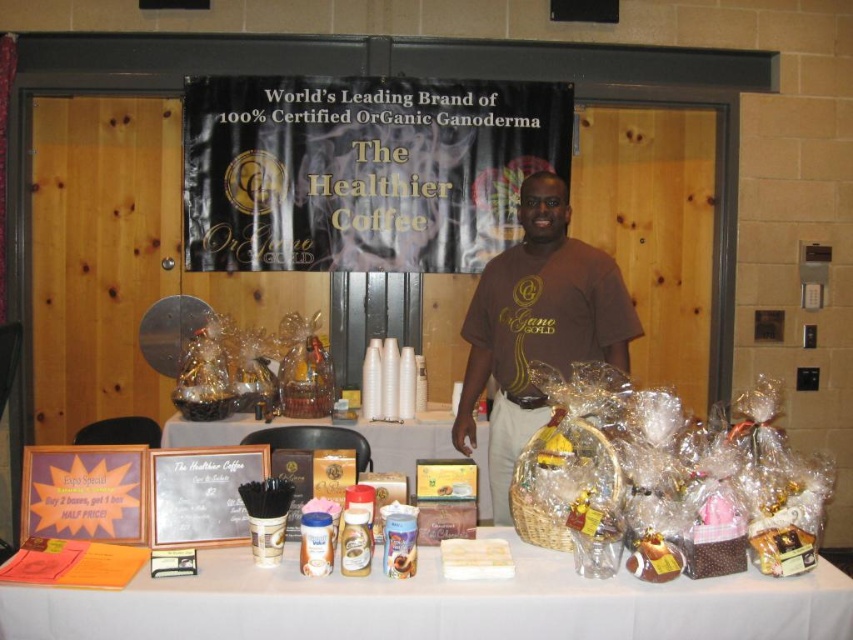
You are setting up a booth for The Healthier Coffee. You need to hang a new banner that is 2 meters tall. The booth currently has a black fabric banner at upper center and a wooden signboard at center. Which object can you place the new banner next to without blocking the other?

The black fabric banner at upper center is much taller than the wooden signboard at center, so placing the new 2m tall banner next to the wooden signboard at center would prevent it from blocking the taller black fabric banner at upper center.

You are a customer at the event and want to take a photo with the black fabric banner at upper center and the matte brown wicker basket at center. Which object should you stand closer to for it to appear larger in your photo?

To make both objects appear larger in your photo, you should stand closer to the black fabric banner at upper center since it is bigger than the matte brown wicker basket at center.

You are a customer at the promotional setup for The Healthier Coffee. You see a black fabric banner at upper center and a white paper at center. Which object is placed higher in the image?

The black fabric banner at upper center is located above the white paper at center, so it is placed higher in the image.